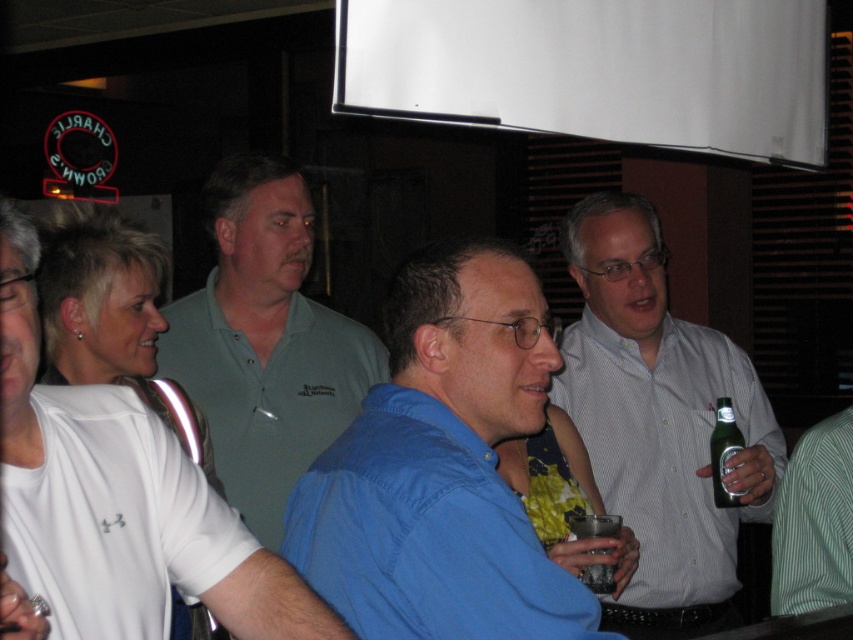
You are at a party and want to know if the white matte polo shirt at left can completely cover the clear plastic cup at center. Based on their sizes, what do you think?

The white matte polo shirt at left is bigger than the clear plastic cup at center, so yes, the white matte polo shirt at left can completely cover the clear plastic cup at center.

From the picture: You are standing in the room and see the point at coordinates (113, 516). Which object is this point located on?

The point at coordinates (113, 516) is located on the white matte polo shirt at left.

In the scene shown: You are at a social event and want to greet the person in the light blue shirt at center. Since you are standing near the white matte polo shirt at left, can you easily see them?

The light blue shirt at center is located above the white matte polo shirt at left, so you can easily see them from your position near the white matte polo shirt at left.